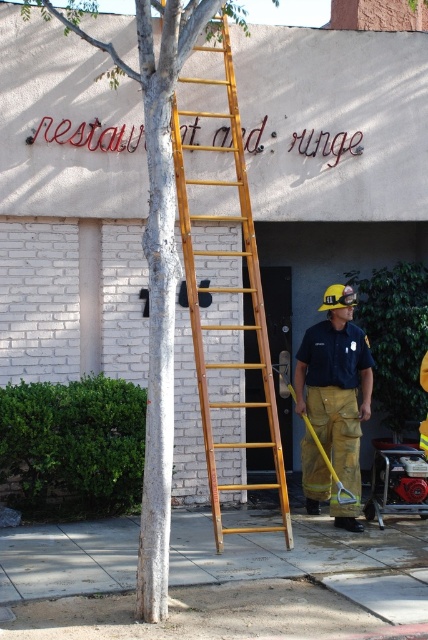
Is wooden ladder at center wider than yellow fire-resistant pants at center?

Correct, the width of wooden ladder at center exceeds that of yellow fire-resistant pants at center.

This screenshot has height=640, width=428. Describe the element at coordinates (246, 291) in the screenshot. I see `wooden ladder at center` at that location.

The image size is (428, 640). In order to click on wooden ladder at center in this screenshot , I will do `click(246, 291)`.

Is white textured tree at center thinner than wooden ladder at center?

Yes.

Which is more to the left, white textured tree at center or wooden ladder at center?

white textured tree at center is more to the left.

Find the location of a particular element. white textured tree at center is located at coordinates click(154, 252).

Where is `white textured tree at center`? white textured tree at center is located at coordinates 154,252.

What do you see at coordinates (154, 252) in the screenshot? The image size is (428, 640). I see `white textured tree at center` at bounding box center [154, 252].

Between white textured tree at center and yellow fire-resistant pants at center, which one has less height?

yellow fire-resistant pants at center

Does point (154, 556) lie behind point (344, 369)?

No, it is not.

This screenshot has height=640, width=428. Identify the location of white textured tree at center. (154, 252).